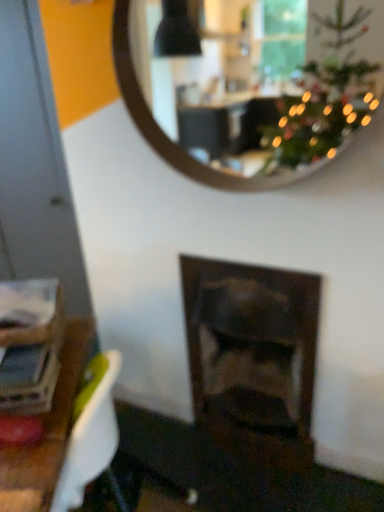
Question: Is dark wood fireplace at center smaller than wooden mirror at upper center?

Choices:
 (A) yes
 (B) no

Answer: (B)

Question: From a real-world perspective, is dark wood fireplace at center on wooden mirror at upper center?

Choices:
 (A) no
 (B) yes

Answer: (A)

Question: Is dark wood fireplace at center oriented away from wooden mirror at upper center?

Choices:
 (A) no
 (B) yes

Answer: (A)

Question: Is dark wood fireplace at center not close to wooden mirror at upper center?

Choices:
 (A) yes
 (B) no

Answer: (A)

Question: Is dark wood fireplace at center touching wooden mirror at upper center?

Choices:
 (A) no
 (B) yes

Answer: (A)

Question: Can we say dark wood fireplace at center lies outside wooden mirror at upper center?

Choices:
 (A) yes
 (B) no

Answer: (A)

Question: Is wooden mirror at upper center completely or partially outside of dark wood fireplace at center?

Choices:
 (A) yes
 (B) no

Answer: (A)

Question: From the image's perspective, is wooden mirror at upper center below dark wood fireplace at center?

Choices:
 (A) no
 (B) yes

Answer: (A)

Question: Can you confirm if wooden mirror at upper center is taller than dark wood fireplace at center?

Choices:
 (A) no
 (B) yes

Answer: (A)

Question: From a real-world perspective, is wooden mirror at upper center below dark wood fireplace at center?

Choices:
 (A) yes
 (B) no

Answer: (B)

Question: Could dark wood fireplace at center be considered to be inside wooden mirror at upper center?

Choices:
 (A) yes
 (B) no

Answer: (B)

Question: From the image's perspective, is wooden mirror at upper center located above dark wood fireplace at center?

Choices:
 (A) yes
 (B) no

Answer: (A)

Question: Is wooden mirror at upper center taller or shorter than dark wood fireplace at center?

Choices:
 (A) tall
 (B) short

Answer: (B)